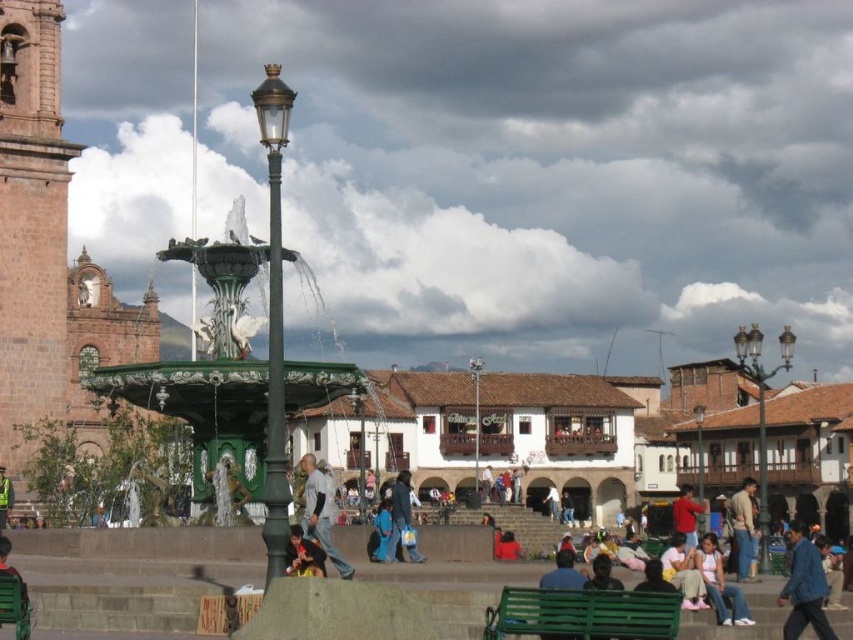
Is polished brass streetlight at upper right below brushed metal lamp post at upper center?

Actually, polished brass streetlight at upper right is above brushed metal lamp post at upper center.

Is polished brass streetlight at upper right to the right of brushed metal lamp post at upper center from the viewer's perspective?

Yes, polished brass streetlight at upper right is to the right of brushed metal lamp post at upper center.

The height and width of the screenshot is (640, 853). Identify the location of polished brass streetlight at upper right. (761, 412).

Which is below, green painted wood bench at lower center or dark blue fabric jacket at center?

dark blue fabric jacket at center is below.

From the picture: Can you confirm if green painted wood bench at lower center is positioned above dark blue fabric jacket at center?

Yes.

You are a GUI agent. You are given a task and a screenshot of the screen. Output one action in this format:
    pyautogui.click(x=<x>, y=<y>)
    Task: Click on the green painted wood bench at lower center
    
    Given the screenshot: What is the action you would take?
    pyautogui.click(x=582, y=614)

Does point (714, 554) come in front of point (473, 387)?

Yes.

Locate an element on the screen. This screenshot has height=640, width=853. light pink fabric at lower right is located at coordinates point(720,584).

In order to click on light pink fabric at lower right in this screenshot , I will do `click(720, 584)`.